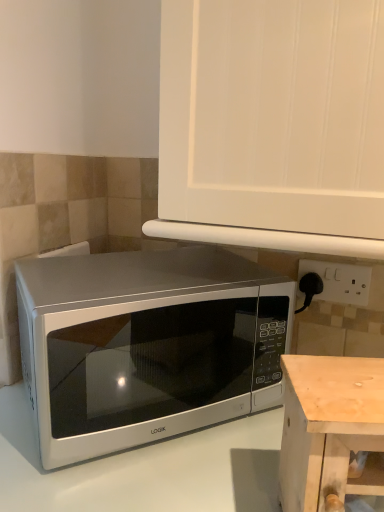
The height and width of the screenshot is (512, 384). Describe the element at coordinates (330, 428) in the screenshot. I see `pine wood table at lower right` at that location.

Where is `satin silver microwave at center`? The width and height of the screenshot is (384, 512). satin silver microwave at center is located at coordinates (147, 346).

Where is `white plastic electric outlet at right`? The image size is (384, 512). white plastic electric outlet at right is located at coordinates (339, 281).

Which of these two, white matte cabinet at upper center or white plastic electric outlet at right, is smaller?

Smaller between the two is white plastic electric outlet at right.

From their relative heights in the image, would you say white matte cabinet at upper center is taller or shorter than white plastic electric outlet at right?

In the image, white matte cabinet at upper center appears to be taller than white plastic electric outlet at right.

Are white matte cabinet at upper center and white plastic electric outlet at right making contact?

There is a gap between white matte cabinet at upper center and white plastic electric outlet at right.

Is white matte cabinet at upper center inside the boundaries of white plastic electric outlet at right, or outside?

white matte cabinet at upper center exists outside the volume of white plastic electric outlet at right.

Based on their sizes in the image, would you say pine wood table at lower right is bigger or smaller than white glossy microwave at lower left?

pine wood table at lower right is smaller than white glossy microwave at lower left.

Measure the distance between pine wood table at lower right and white glossy microwave at lower left.

A distance of 7.55 inches exists between pine wood table at lower right and white glossy microwave at lower left.

Considering the positions of points (313, 461) and (10, 412), is point (313, 461) farther from camera compared to point (10, 412)?

No, (313, 461) is closer to viewer.

Are pine wood table at lower right and white glossy microwave at lower left making contact?

pine wood table at lower right and white glossy microwave at lower left are not in contact.

Between white plastic electric outlet at right and white matte cabinet at upper center, which one has smaller width?

white plastic electric outlet at right is thinner.

Is white plastic electric outlet at right not inside white matte cabinet at upper center?

That's correct, white plastic electric outlet at right is outside of white matte cabinet at upper center.

Identify the location of electric outlet on the right of white matte cabinet at upper center. (339, 281).

Considering the positions of point (333, 285) and point (207, 150), is point (333, 285) closer or farther from the camera than point (207, 150)?

Point (333, 285) appears to be farther away from the viewer than point (207, 150).

Locate an element on the screen. The width and height of the screenshot is (384, 512). counter top on the left of white matte cabinet at upper center is located at coordinates (145, 468).

Measure the distance between white glossy microwave at lower left and white matte cabinet at upper center.

The distance of white glossy microwave at lower left from white matte cabinet at upper center is 18.47 inches.

Does white glossy microwave at lower left come behind white matte cabinet at upper center?

No, white glossy microwave at lower left is closer to the camera.

Is white matte cabinet at upper center at the back of white glossy microwave at lower left?

white glossy microwave at lower left does not have its back to white matte cabinet at upper center.

How different are the orientations of white plastic electric outlet at right and white glossy microwave at lower left in degrees?

The angular difference between white plastic electric outlet at right and white glossy microwave at lower left is 3.87 degrees.

Where is `counter top in front of the white plastic electric outlet at right`? The height and width of the screenshot is (512, 384). counter top in front of the white plastic electric outlet at right is located at coordinates (145, 468).

Is white plastic electric outlet at right wider or thinner than white glossy microwave at lower left?

Considering their sizes, white plastic electric outlet at right looks slimmer than white glossy microwave at lower left.

From the image's perspective, which one is positioned higher, white glossy microwave at lower left or satin silver microwave at center?

satin silver microwave at center appears higher in the image.

Does white glossy microwave at lower left have a larger size compared to satin silver microwave at center?

Yes, white glossy microwave at lower left is bigger than satin silver microwave at center.

In the image, there is a white glossy microwave at lower left. Identify the location of microwave oven above it (from the image's perspective). (147, 346).

Is satin silver microwave at center located within white glossy microwave at lower left?

No, white glossy microwave at lower left does not contain satin silver microwave at center.

Looking at their sizes, would you say white glossy microwave at lower left is wider or thinner than pine wood table at lower right?

white glossy microwave at lower left is wider than pine wood table at lower right.

Is white glossy microwave at lower left far away from pine wood table at lower right?

No, white glossy microwave at lower left is not far from pine wood table at lower right.

From the image's perspective, who appears lower, white glossy microwave at lower left or pine wood table at lower right?

white glossy microwave at lower left is shown below in the image.

The height and width of the screenshot is (512, 384). In order to click on electric outlet that appears behind the white matte cabinet at upper center in this screenshot , I will do `click(339, 281)`.

Where is `counter top located below the pine wood table at lower right (from the image's perspective)`? This screenshot has height=512, width=384. counter top located below the pine wood table at lower right (from the image's perspective) is located at coordinates (145, 468).

From the image, which object appears to be farther from pine wood table at lower right, white matte cabinet at upper center or white glossy microwave at lower left?

white matte cabinet at upper center is further to pine wood table at lower right.

Estimate the real-world distances between objects in this image. Which object is closer to satin silver microwave at center, white matte cabinet at upper center or pine wood table at lower right?

Among the two, pine wood table at lower right is located nearer to satin silver microwave at center.

From the picture: Based on their spatial positions, is white glossy microwave at lower left or pine wood table at lower right closer to white matte cabinet at upper center?

Among the two, pine wood table at lower right is located nearer to white matte cabinet at upper center.

From the image, which object appears to be nearer to white glossy microwave at lower left, satin silver microwave at center or white matte cabinet at upper center?

satin silver microwave at center is positioned closer to the anchor white glossy microwave at lower left.

Which object lies further to the anchor point white plastic electric outlet at right, white matte cabinet at upper center or pine wood table at lower right?

Based on the image, pine wood table at lower right appears to be further to white plastic electric outlet at right.

Which object lies further to the anchor point white glossy microwave at lower left, pine wood table at lower right or white matte cabinet at upper center?

white matte cabinet at upper center is further to white glossy microwave at lower left.

Which object lies further to the anchor point white glossy microwave at lower left, satin silver microwave at center or white plastic electric outlet at right?

white plastic electric outlet at right is positioned further to the anchor white glossy microwave at lower left.

Looking at this image, considering their positions, is white plastic electric outlet at right positioned further to pine wood table at lower right than satin silver microwave at center?

white plastic electric outlet at right is further to pine wood table at lower right.

This screenshot has width=384, height=512. Identify the location of electric outlet between white matte cabinet at upper center and pine wood table at lower right in the vertical direction. (339, 281).

At what (x,y) coordinates should I click in order to perform the action: click on table that lies between white matte cabinet at upper center and white glossy microwave at lower left from top to bottom. Please return your answer as a coordinate pair (x, y). This screenshot has height=512, width=384. Looking at the image, I should click on (330, 428).

Locate an element on the screen. The height and width of the screenshot is (512, 384). microwave oven between white matte cabinet at upper center and white glossy microwave at lower left in the up-down direction is located at coordinates [x=147, y=346].

The image size is (384, 512). Find the location of `microwave oven between white matte cabinet at upper center and pine wood table at lower right vertically`. microwave oven between white matte cabinet at upper center and pine wood table at lower right vertically is located at coordinates (147, 346).